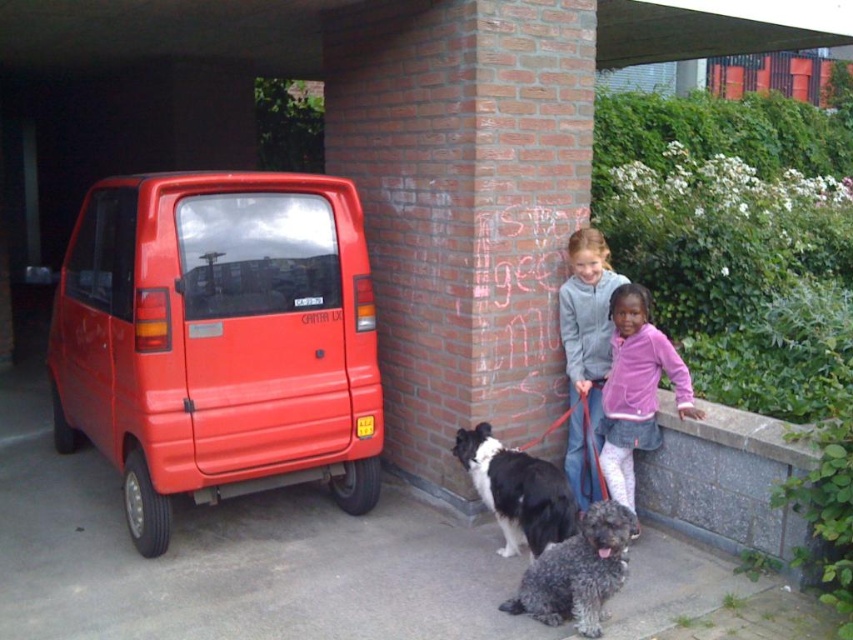
Is the position of curly gray fur at lower center more distant than that of black and white fur dog at center?

No, curly gray fur at lower center is closer to the viewer.

This screenshot has height=640, width=853. Identify the location of curly gray fur at lower center. (577, 572).

Where is `curly gray fur at lower center`? This screenshot has width=853, height=640. curly gray fur at lower center is located at coordinates (577, 572).

Can you confirm if pink fleece jacket at center is taller than curly gray fur at lower center?

Correct, pink fleece jacket at center is much taller as curly gray fur at lower center.

Who is more forward, (639, 385) or (587, 556)?

Positioned in front is point (587, 556).

Locate an element on the screen. This screenshot has height=640, width=853. pink fleece jacket at center is located at coordinates tap(636, 388).

Does pink fleece jacket at center appear under matte gray hoodie at center?

Indeed, pink fleece jacket at center is positioned under matte gray hoodie at center.

Does pink fleece jacket at center have a lesser width compared to matte gray hoodie at center?

In fact, pink fleece jacket at center might be wider than matte gray hoodie at center.

Image resolution: width=853 pixels, height=640 pixels. Find the location of `pink fleece jacket at center`. pink fleece jacket at center is located at coordinates (636, 388).